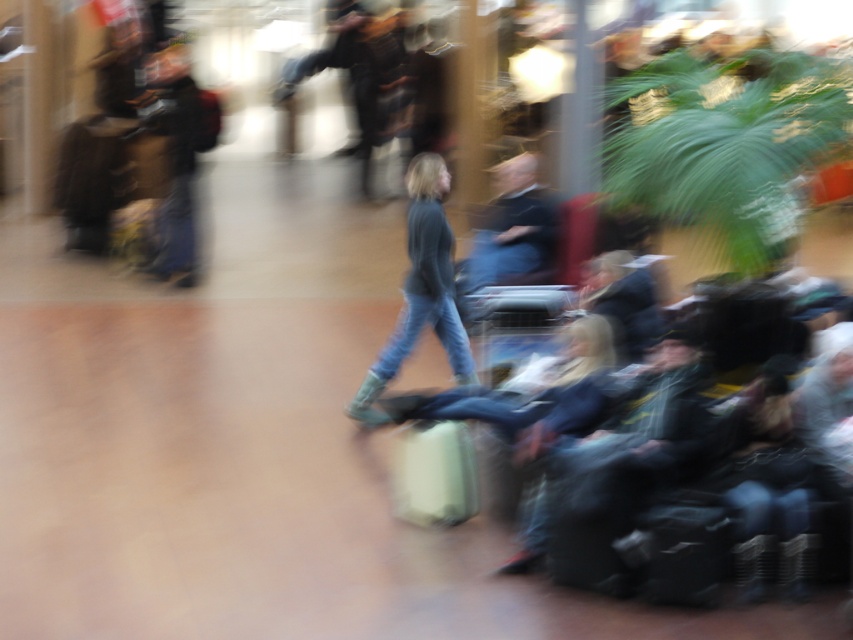
Question: Which of the following is the closest to the observer?

Choices:
 (A) denim jeans at center
 (B) dark blue sweater at center

Answer: (A)

Question: Is dark blue sweater at center to the right of black matte suitcase at lower right from the viewer's perspective?

Choices:
 (A) yes
 (B) no

Answer: (B)

Question: Observing the image, what is the correct spatial positioning of dark blue sweater at center in reference to black matte suitcase at lower right?

Choices:
 (A) below
 (B) above

Answer: (B)

Question: Which object is the farthest from the beige fabric suitcase at center?

Choices:
 (A) dark blue sweater at center
 (B) black matte suitcase at lower right

Answer: (A)

Question: Which point is farther to the camera?

Choices:
 (A) (509, 193)
 (B) (434, 444)
 (C) (428, 289)

Answer: (A)

Question: Is denim jeans at center to the left of beige fabric suitcase at center from the viewer's perspective?

Choices:
 (A) yes
 (B) no

Answer: (B)